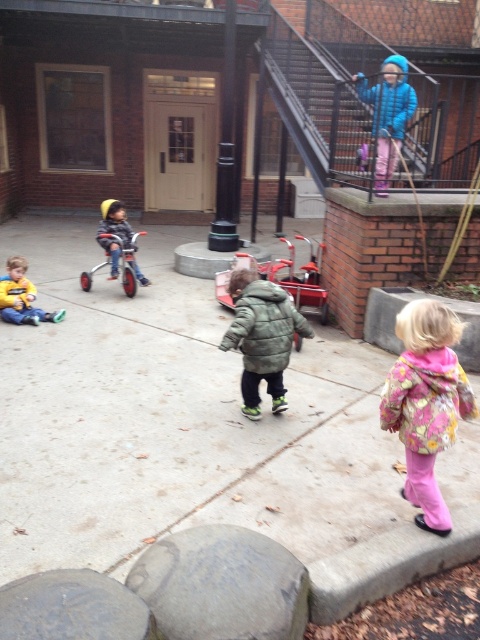
Question: Which point appears closest to the camera in this image?

Choices:
 (A) (267, 72)
 (B) (256, 369)
 (C) (67, 529)

Answer: (C)

Question: Which point is closer to the camera taking this photo?

Choices:
 (A) (274, 99)
 (B) (444, 417)

Answer: (B)

Question: From the image, what is the correct spatial relationship of floral fabric coat at lower right in relation to yellow fleece jacket at lower left?

Choices:
 (A) right
 (B) left

Answer: (A)

Question: Which point appears closest to the camera in this image?

Choices:
 (A) (199, 317)
 (B) (315, 298)
 (C) (456, 355)
 (D) (427, 408)

Answer: (D)

Question: In this image, where is green fuzzy jacket at center located relative to matte red tricycle at left?

Choices:
 (A) above
 (B) below

Answer: (B)

Question: Can you confirm if green fuzzy jacket at center is wider than matte blue helmet at left?

Choices:
 (A) yes
 (B) no

Answer: (A)